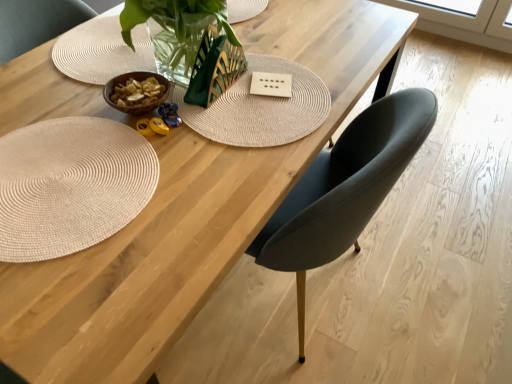
The image size is (512, 384). Find the location of `free space to the left of white matte card at center`. free space to the left of white matte card at center is located at coordinates (214, 100).